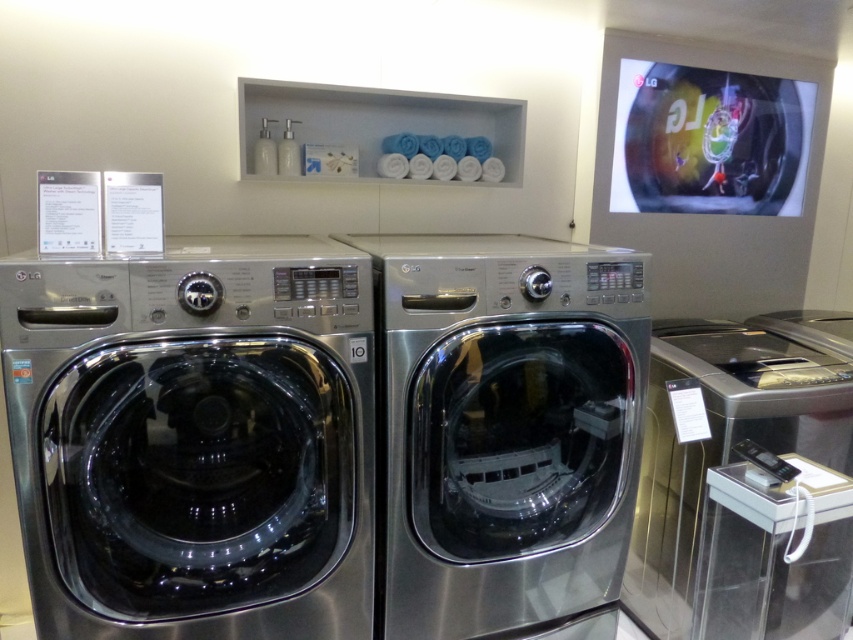
Question: Which of the following is the farthest from the observer?

Choices:
 (A) (492, 278)
 (B) (772, 545)

Answer: (B)

Question: Does stainless steel dryer at center have a lesser width compared to stainless steel dryer at right?

Choices:
 (A) no
 (B) yes

Answer: (B)

Question: Which point is farther from the camera taking this photo?

Choices:
 (A) (219, 388)
 (B) (444, 579)

Answer: (B)

Question: Is the position of stainless steel washing machine at left more distant than that of stainless steel dryer at right?

Choices:
 (A) no
 (B) yes

Answer: (A)

Question: Is stainless steel washing machine at left to the right of stainless steel dryer at right from the viewer's perspective?

Choices:
 (A) yes
 (B) no

Answer: (B)

Question: Which object is positioned farthest from the stainless steel dryer at center?

Choices:
 (A) stainless steel washing machine at left
 (B) stainless steel dryer at right

Answer: (B)